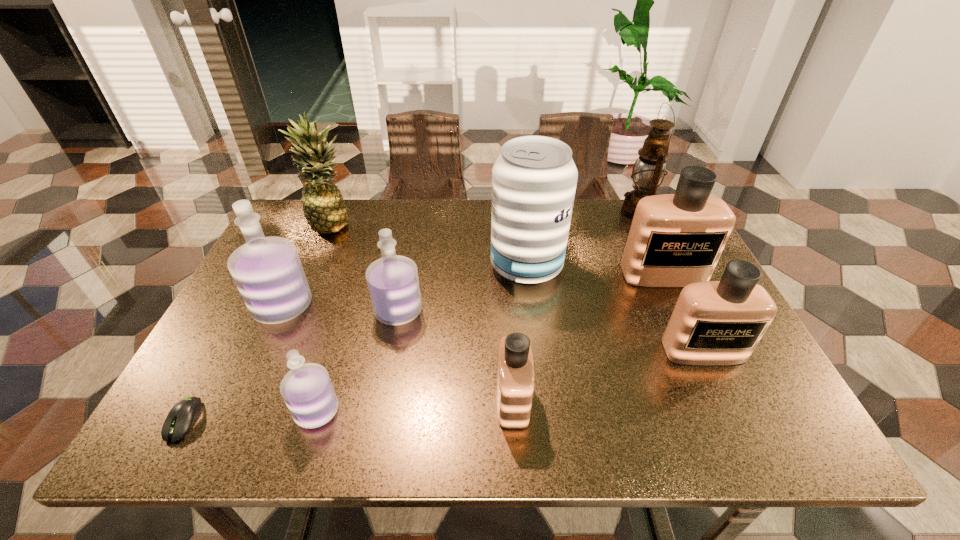
Identify the location of vacant space at the left edge. (216, 370).

Where is `vacant space at the right edge of the desktop`? The width and height of the screenshot is (960, 540). vacant space at the right edge of the desktop is located at coordinates (715, 397).

The image size is (960, 540). What are the coordinates of `free region at the far right corner` in the screenshot? It's located at (621, 200).

I want to click on vacant space in between the oil lamp and the alcohol, so click(582, 239).

The height and width of the screenshot is (540, 960). I want to click on empty location between the gray computer mouse and the second biggest beige perfume, so click(x=444, y=386).

Locate an element on the screen. The width and height of the screenshot is (960, 540). free point between the third perfume from right to left and the sixth object from right to left is located at coordinates [455, 355].

Find the location of a particular element. The height and width of the screenshot is (540, 960). vacant point located between the biggest beige perfume and the smallest beige perfume is located at coordinates (588, 337).

Identify the location of free space that is in between the leftmost beige perfume and the leftmost perfume. (397, 353).

Identify the location of vacant space that's between the fifth perfume from right to left and the farthest beige perfume. The width and height of the screenshot is (960, 540). (491, 342).

What are the coordinates of `blank region between the gray computer mouse and the biggest beige perfume` in the screenshot? It's located at (423, 347).